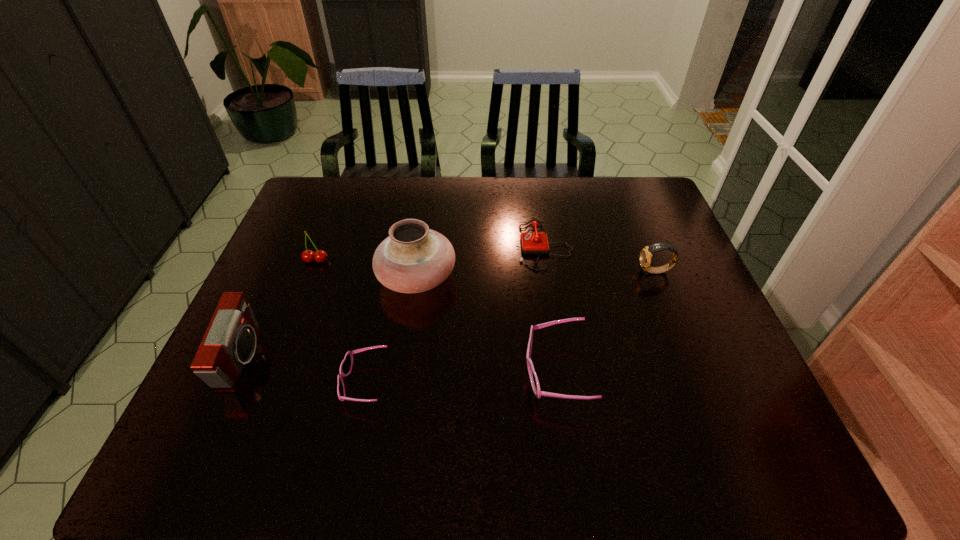
The width and height of the screenshot is (960, 540). Find the location of `vacant space located 0.340m on the face of the watch`. vacant space located 0.340m on the face of the watch is located at coordinates (518, 272).

You are a GUI agent. You are given a task and a screenshot of the screen. Output one action in this format:
    pyautogui.click(x=<x>, y=<y>)
    Task: Click on the free space located 0.050m on the face of the watch
    
    Given the screenshot: What is the action you would take?
    pyautogui.click(x=621, y=272)

In order to click on vacant region located 0.160m with the stems of the sixth object from right to left pointing upwards in this screenshot , I will do `click(298, 307)`.

Identify the location of vacant space situated 0.290m on the front-facing side of the camera. Image resolution: width=960 pixels, height=540 pixels. (381, 358).

Identify the location of vacant space situated on the back of the pottery. (427, 203).

This screenshot has width=960, height=540. What are the coordinates of `camera at the near edge` in the screenshot? It's located at (229, 342).

Where is `cherry that is at the left edge`? This screenshot has height=540, width=960. cherry that is at the left edge is located at coordinates (320, 256).

Locate an element on the screen. The image size is (960, 540). camera that is at the left edge is located at coordinates (229, 342).

At what (x,y) coordinates should I click in order to perform the action: click on object located at the right edge. Please return your answer as a coordinate pair (x, y). Looking at the image, I should click on (646, 254).

Locate an element on the screen. This screenshot has height=540, width=960. object present at the near left corner is located at coordinates (229, 342).